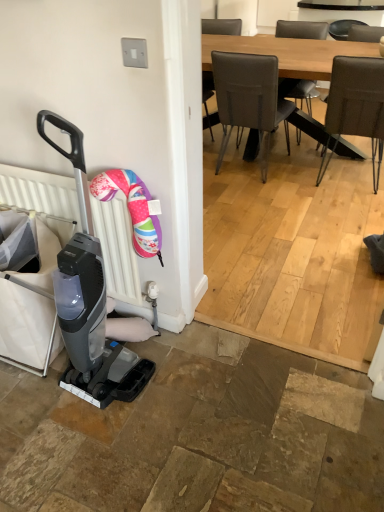
Question: Would you consider leather-like brown chair at upper right to be distant from matte black baby carriage at left?

Choices:
 (A) yes
 (B) no

Answer: (A)

Question: Can you confirm if leather-like brown chair at upper right is taller than matte black baby carriage at left?

Choices:
 (A) yes
 (B) no

Answer: (B)

Question: Can you confirm if leather-like brown chair at upper right is smaller than matte black baby carriage at left?

Choices:
 (A) yes
 (B) no

Answer: (B)

Question: Considering the relative sizes of leather-like brown chair at upper right and matte black baby carriage at left in the image provided, is leather-like brown chair at upper right wider than matte black baby carriage at left?

Choices:
 (A) no
 (B) yes

Answer: (B)

Question: Does leather-like brown chair at upper right turn towards matte black baby carriage at left?

Choices:
 (A) no
 (B) yes

Answer: (A)

Question: Considering the relative sizes of leather-like brown chair at upper right and matte black baby carriage at left in the image provided, is leather-like brown chair at upper right bigger than matte black baby carriage at left?

Choices:
 (A) yes
 (B) no

Answer: (A)

Question: Is white plastic radiator at left located within light brown wooden table at upper center?

Choices:
 (A) no
 (B) yes

Answer: (A)

Question: Does light brown wooden table at upper center have a lesser height compared to white plastic radiator at left?

Choices:
 (A) no
 (B) yes

Answer: (A)

Question: From a real-world perspective, is light brown wooden table at upper center on top of white plastic radiator at left?

Choices:
 (A) yes
 (B) no

Answer: (B)

Question: Considering the relative sizes of light brown wooden table at upper center and white plastic radiator at left in the image provided, is light brown wooden table at upper center wider than white plastic radiator at left?

Choices:
 (A) yes
 (B) no

Answer: (A)

Question: Can we say light brown wooden table at upper center lies outside white plastic radiator at left?

Choices:
 (A) yes
 (B) no

Answer: (A)

Question: Considering the relative positions of light brown wooden table at upper center and white plastic radiator at left in the image provided, is light brown wooden table at upper center to the left of white plastic radiator at left from the viewer's perspective?

Choices:
 (A) no
 (B) yes

Answer: (A)

Question: Is light brown wooden table at upper center completely or partially inside matte black baby carriage at left?

Choices:
 (A) yes
 (B) no

Answer: (B)